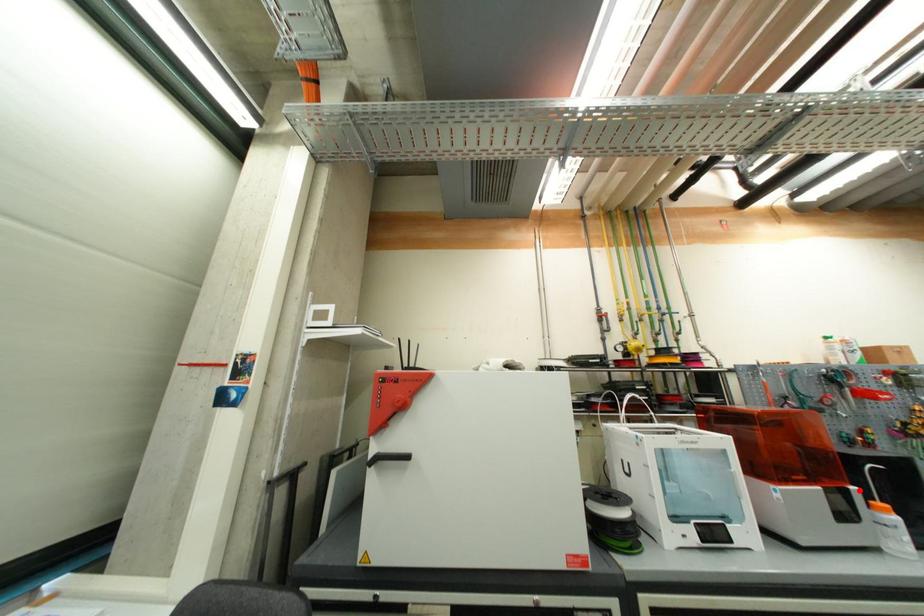
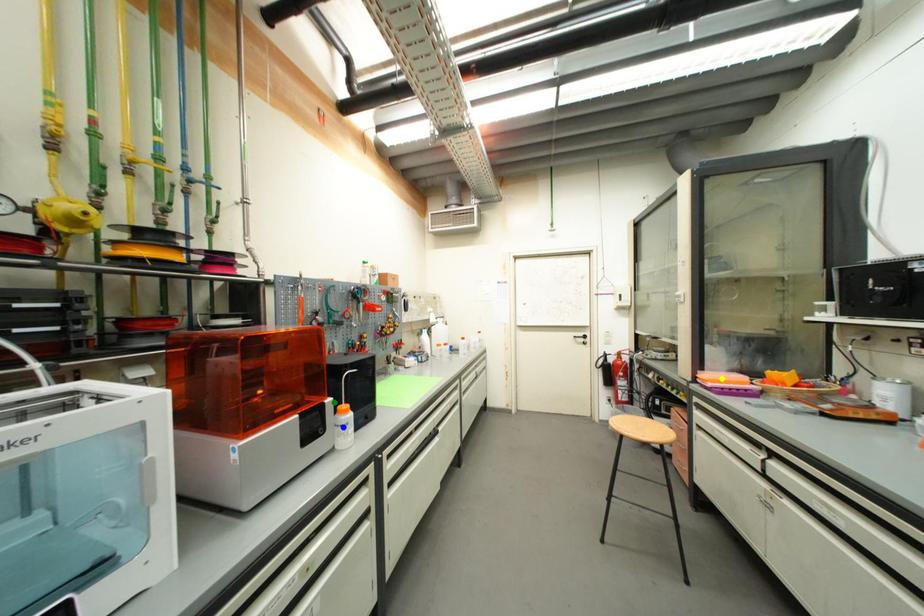
Question: I am providing you with two images of the same scene from different viewpoints. A red point is marked on the first image. You are given multiple points on the second image. Can you choose the point in image 2 that corresponds to the point in image 1?

Choices:
 (A) blue point
 (B) yellow point
 (C) green point

Answer: (C)